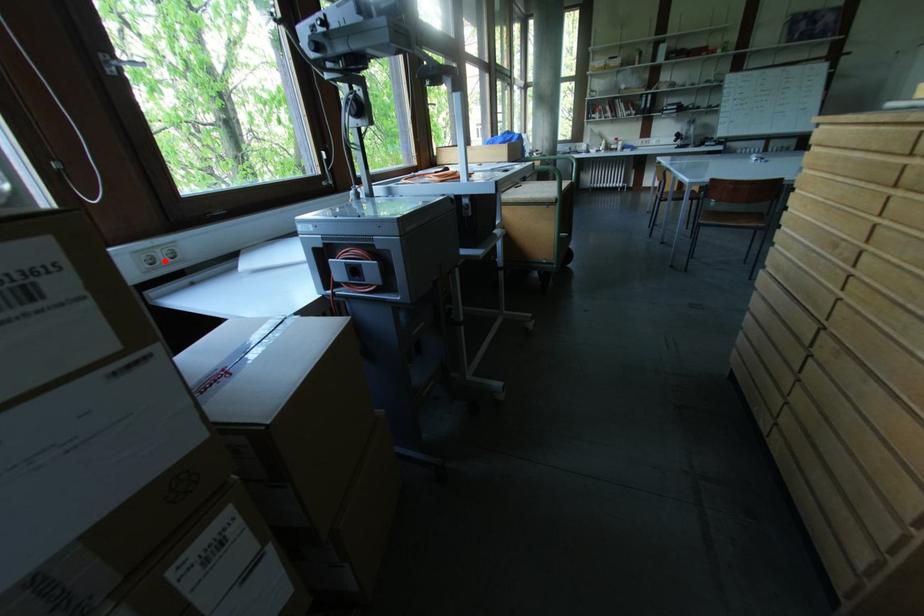
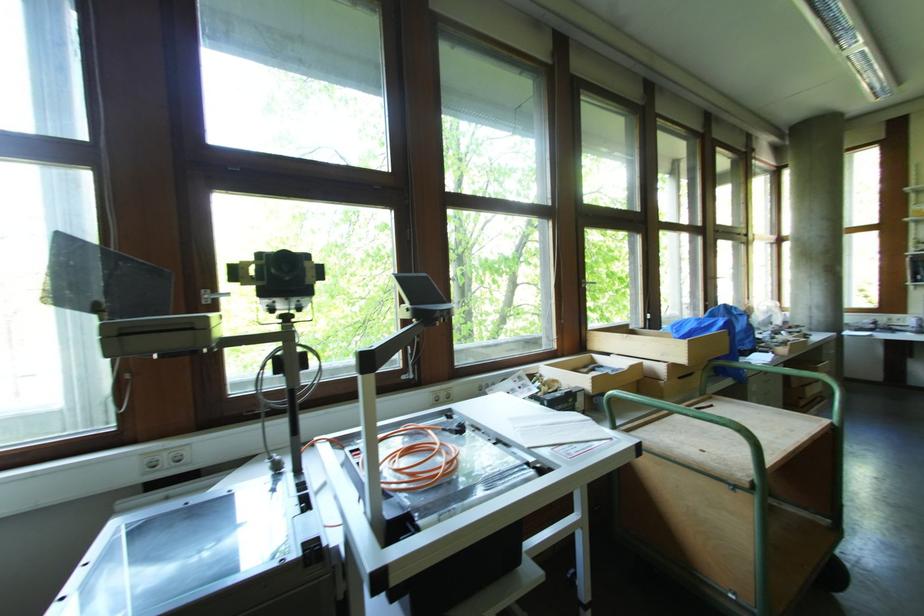
In the second image, find the point that corresponds to the highlighted location in the first image.

(168, 464)